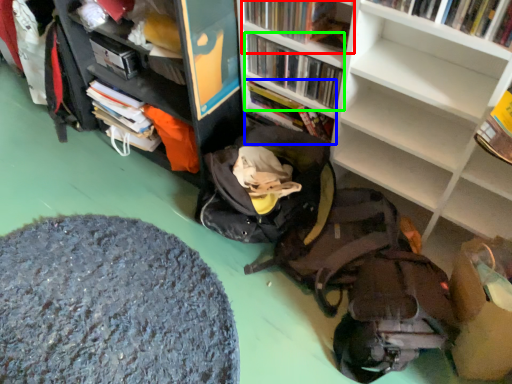
Question: Estimate the real-world distances between objects in this image. Which object is farther from book (highlighted by a red box), book (highlighted by a blue box) or book (highlighted by a green box)?

Choices:
 (A) book
 (B) book

Answer: (A)